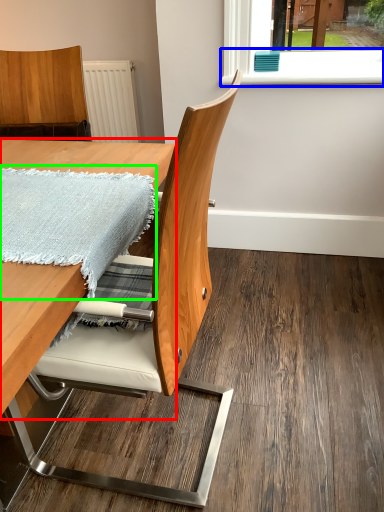
Question: Which is nearer to the table (highlighted by a red box)? window sill (highlighted by a blue box) or blanket (highlighted by a green box).

Choices:
 (A) window sill
 (B) blanket

Answer: (B)